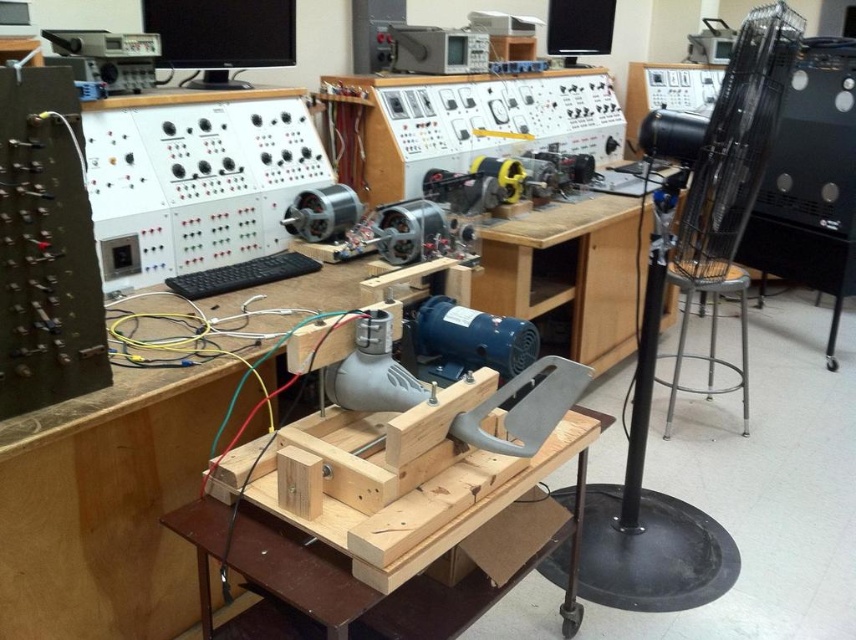
In the scene shown: Who is more distant from viewer, (354,612) or (678,364)?

Point (678,364)

Does wooden at center have a greater height compared to metallic silver stool at right?

No.

Which is in front, point (288, 572) or point (694, 356)?

Point (288, 572)

Find the location of `wooden at center`. wooden at center is located at coordinates (266, 563).